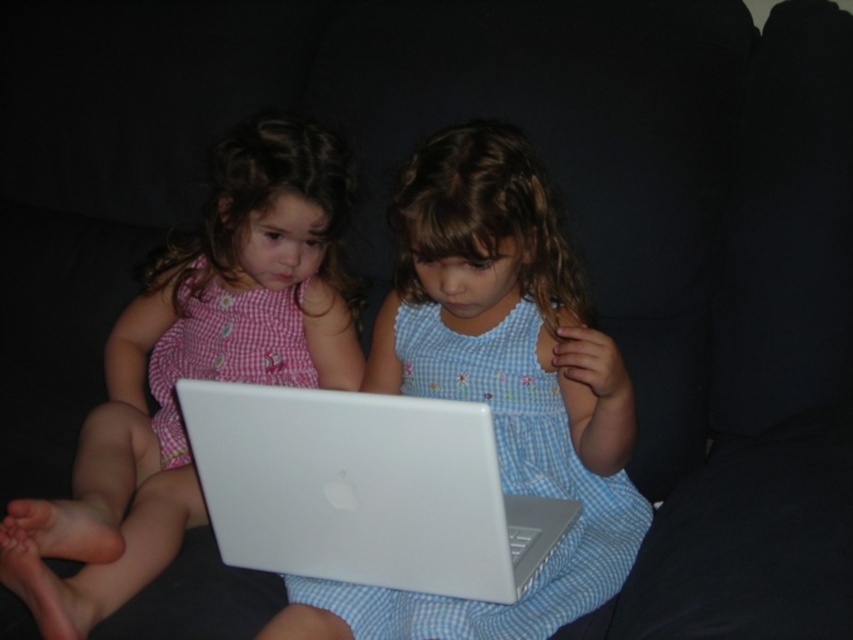
Question: Among these points, which one is nearest to the camera?

Choices:
 (A) (35, 595)
 (B) (570, 445)
 (C) (505, 522)

Answer: (C)

Question: Estimate the real-world distances between objects in this image. Which object is closer to the matte pink dress at center?

Choices:
 (A) matte white laptop at center
 (B) white glossy laptop at center

Answer: (A)

Question: Which point is farther to the camera?

Choices:
 (A) (550, 408)
 (B) (378, 456)

Answer: (A)

Question: Can you confirm if matte pink dress at center is positioned above white glossy laptop at center?

Choices:
 (A) no
 (B) yes

Answer: (B)

Question: In this image, where is matte white laptop at center located relative to matte pink dress at center?

Choices:
 (A) above
 (B) below

Answer: (A)

Question: Does matte white laptop at center appear on the right side of white glossy laptop at center?

Choices:
 (A) no
 (B) yes

Answer: (B)